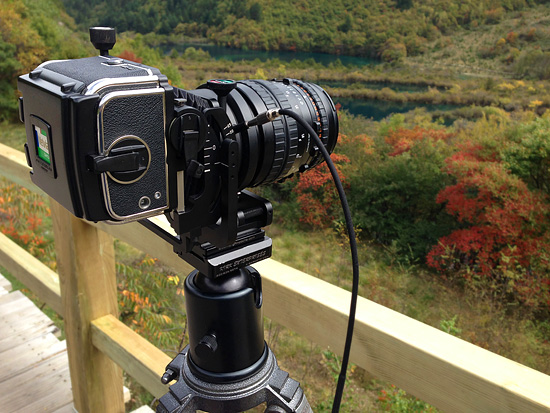
Where is `stainless steel border on side`? stainless steel border on side is located at coordinates (129, 93), (167, 123), (147, 212), (103, 192).